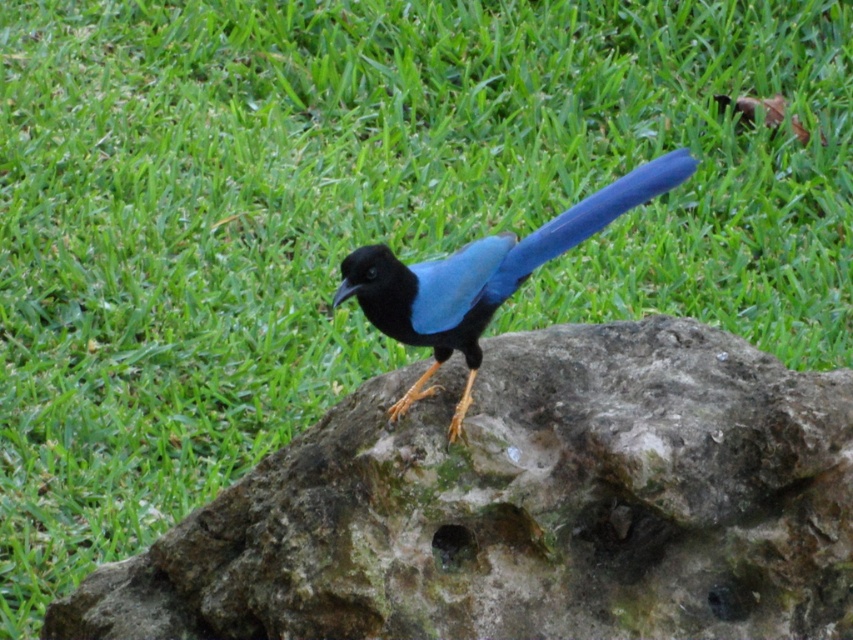
You are a birdwatcher trying to photograph the glossy blue bird at center. You notice the rough stone boulder at center is in the way. Can you estimate if the bird is taller than the boulder?

The rough stone boulder at center is much taller than the glossy blue bird at center, so the bird is not taller than the boulder.

You are a small insect trying to crawl from the glossy blue bird at center to the rough stone boulder at center. Given that your maximum crawling distance is 10 inches, can you reach the boulder?

The distance between the glossy blue bird at center and the rough stone boulder at center is 11.50 inches, which is beyond your maximum crawling distance of 10 inches. Therefore, you cannot reach the boulder.